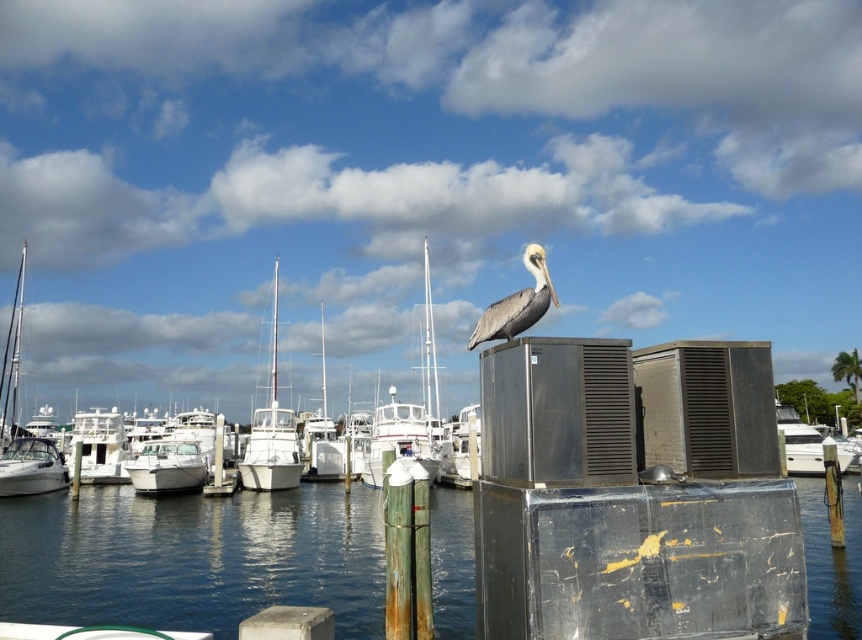
Question: Can you confirm if clear blue water at center is positioned to the right of white glossy boat at center?

Choices:
 (A) no
 (B) yes

Answer: (B)

Question: Which object appears farthest from the camera in this image?

Choices:
 (A) brown feathered pelican at center
 (B) white glossy sailboat at left
 (C) white glossy boat at left

Answer: (C)

Question: Which of the following is the farthest from the observer?

Choices:
 (A) (258, 435)
 (B) (366, 472)
 (C) (814, 435)

Answer: (C)

Question: Which point is closer to the camera?

Choices:
 (A) (517, 317)
 (B) (806, 449)

Answer: (A)

Question: Is white glossy boat at center wider than white glossy boat at left?

Choices:
 (A) yes
 (B) no

Answer: (A)

Question: Does white glossy sailboat at left appear on the right side of brown feathered pelican at center?

Choices:
 (A) no
 (B) yes

Answer: (A)